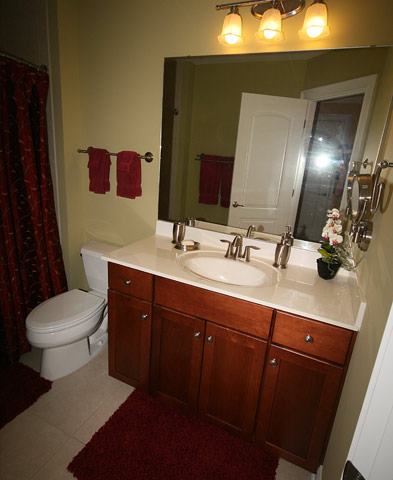
Locate an element on the screen. Image resolution: width=393 pixels, height=480 pixels. soap dispenser is located at coordinates (280, 254).